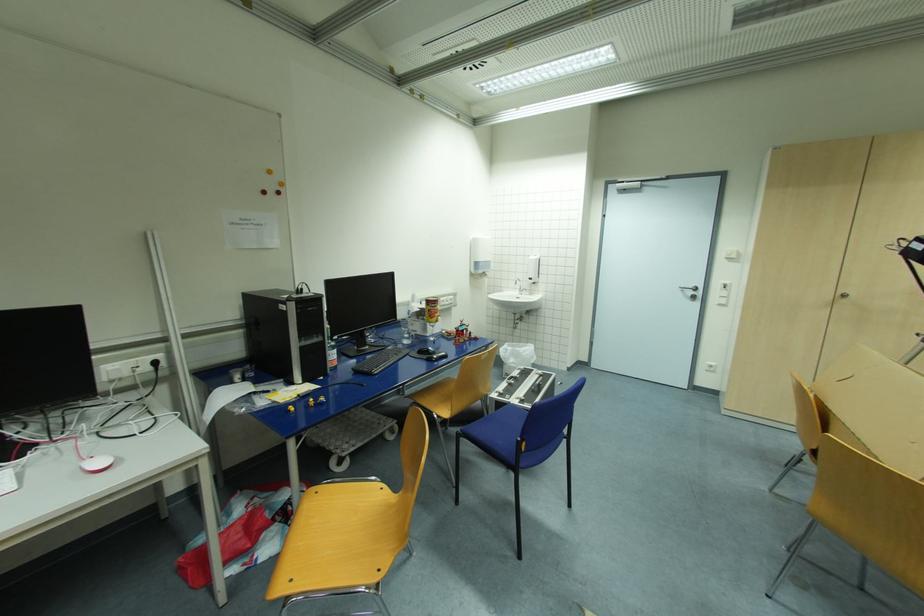
You are a GUI agent. You are given a task and a screenshot of the screen. Output one action in this format:
    pyautogui.click(x=<x>, y=<y>)
    Task: Click on the yellow squeeze bottle
    The width and height of the screenshot is (924, 616).
    Given the screenshot: What is the action you would take?
    pyautogui.click(x=431, y=309)